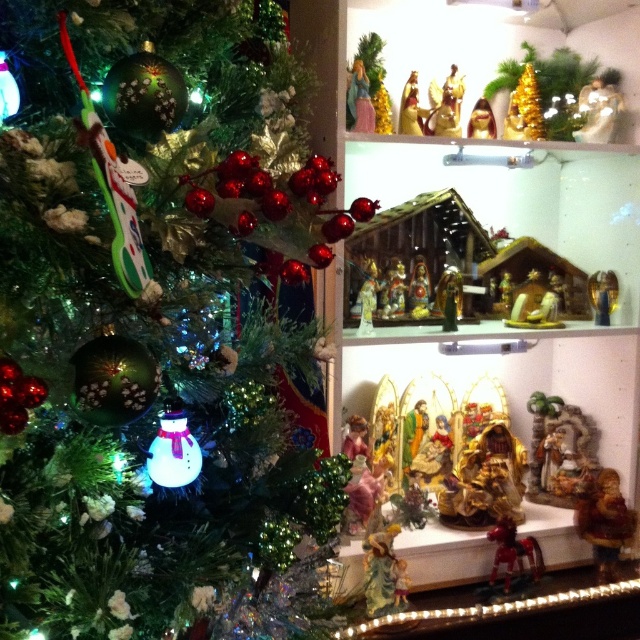
What is located at the coordinates point (x=600, y=108)?

The gold metallic angel at upper center is located at point (x=600, y=108).

You are setting up a Christmas display and want to place a new ornament between the gold metallic figurine at lower right and the gold metallic nativity scene at center. Based on their positions, where should you place the ornament?

The gold metallic figurine at lower right is located below the gold metallic nativity scene at center, so you should place the ornament between them in the vertical space between the lower right figurine and the center nativity scene.

Consider the image. You are standing in front of the shelves displaying the nativity scene. You want to place a new star ornament at the very top of the shelves. Is the gold metallic angel at upper center in the way of placing the star?

The gold metallic angel at upper center is located at point (600,108), which is not at the topmost position of the shelves. Therefore, placing the star ornament at the very top should be possible without moving the gold metallic angel at upper center.